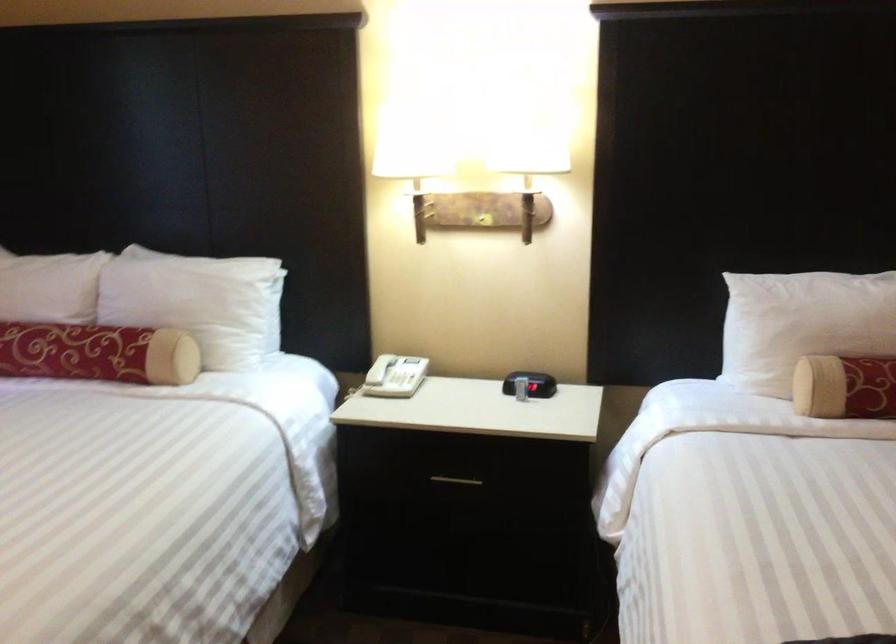
This screenshot has height=644, width=896. Describe the element at coordinates (455, 480) in the screenshot. I see `a silver drawer handle` at that location.